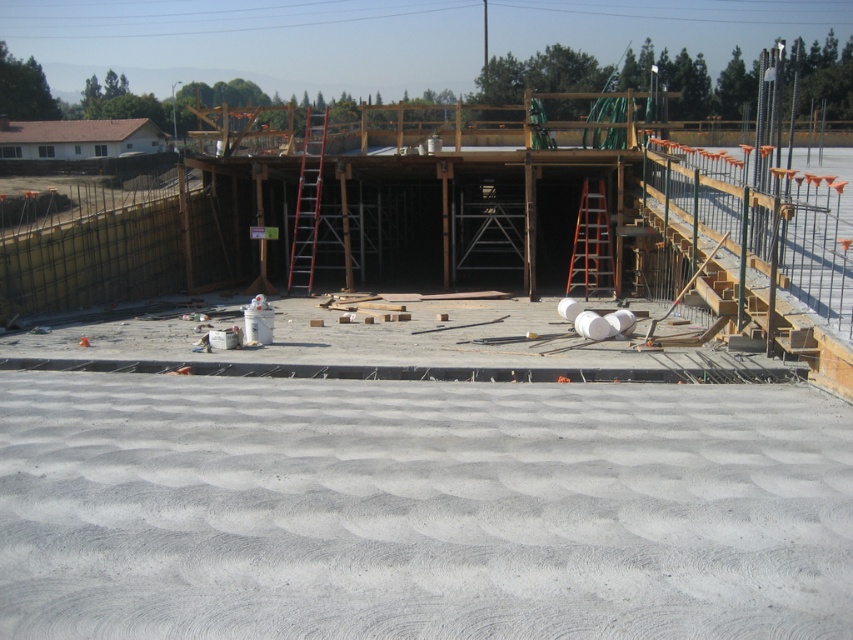
You are a construction worker who needs to move a heavy tool from the smooth concrete floor at center to the red metal ladder at center. Considering their sizes, which object will require more space to maneuver around?

The red metal ladder at center requires more space to maneuver around since it is larger than the smooth concrete floor at center according to the description.

You are a construction worker needing to reach the third floor of the unfinished building structure. You have access to both the red metal ladder at center and the orange metallic ladder at center. Which ladder should you choose to safely reach the third floor?

The red metal ladder at center is much taller than the orange metallic ladder at center, so you should choose the red metal ladder at center to safely reach the third floor.